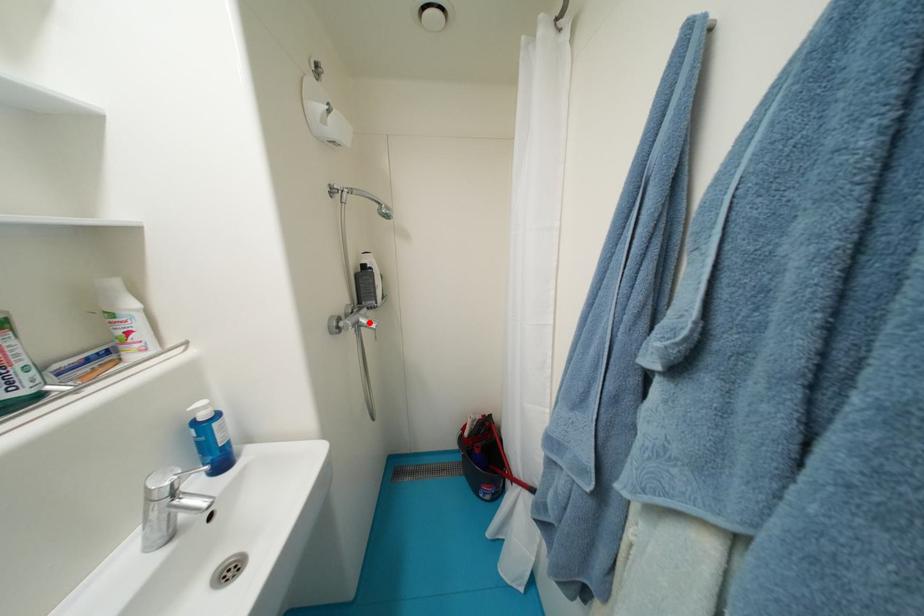
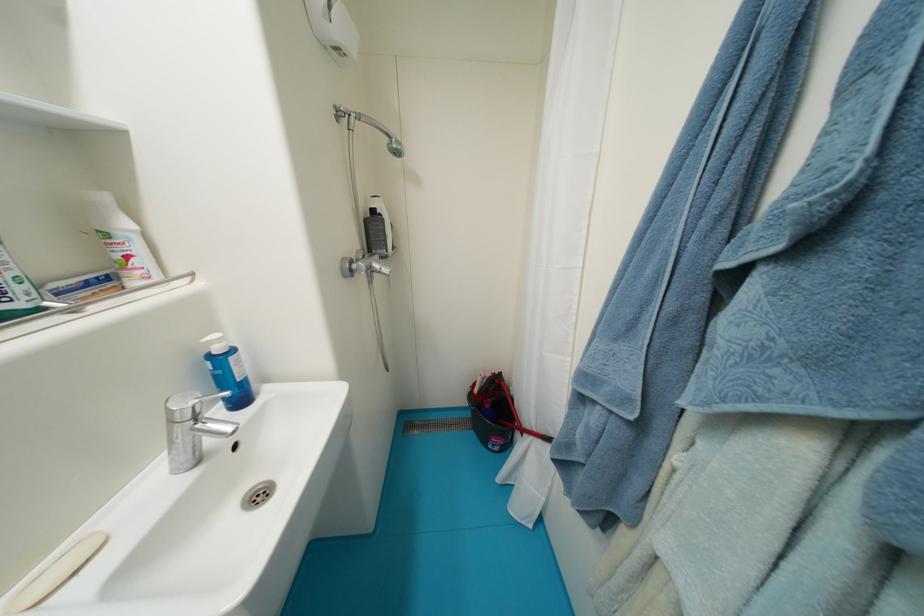
The point at the highlighted location is marked in the first image. Where is the corresponding point in the second image?

(383, 267)